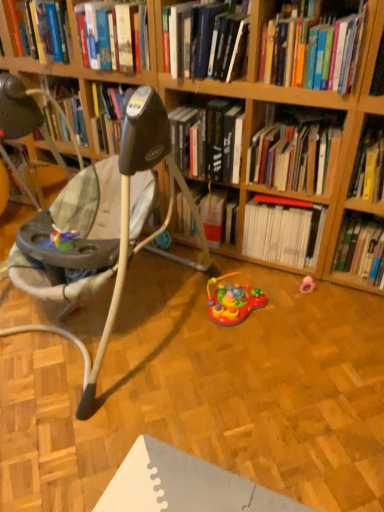
Where is `free space to the right of multicolored plastic toy at center, marked as the second toy in a right-to-left arrangement`? free space to the right of multicolored plastic toy at center, marked as the second toy in a right-to-left arrangement is located at coordinates (294, 311).